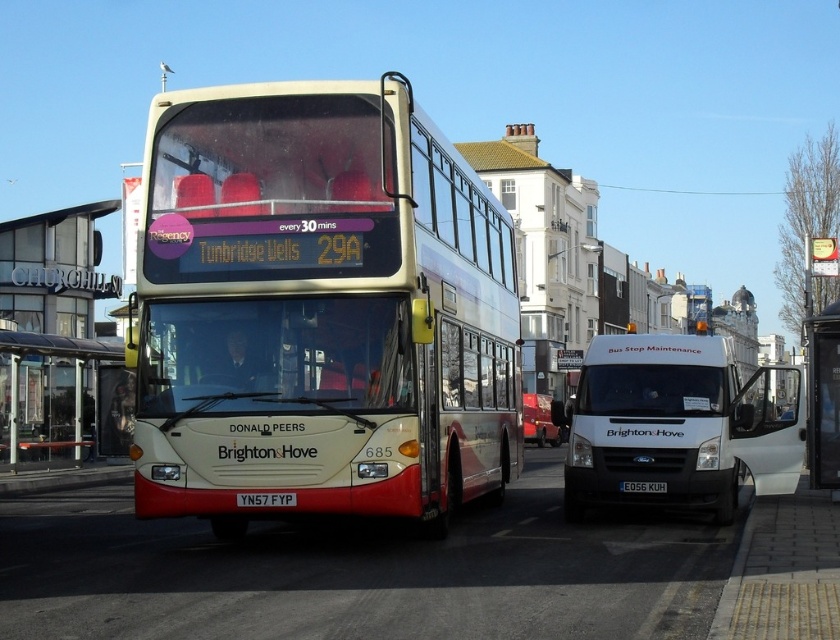
Question: Considering the relative positions of matte cream double-decker bus at center and white matte van at center in the image provided, where is matte cream double-decker bus at center located with respect to white matte van at center?

Choices:
 (A) above
 (B) below

Answer: (B)

Question: Among these objects, which one is farthest from the camera?

Choices:
 (A) yellow metallic license plate at center
 (B) transparent glass bus stop at left
 (C) black plastic license plate at center

Answer: (B)

Question: Does white matte van at center have a lesser width compared to transparent glass bus stop at left?

Choices:
 (A) yes
 (B) no

Answer: (B)

Question: Which point is farther from the camera taking this photo?

Choices:
 (A) (237, 500)
 (B) (13, 424)

Answer: (B)

Question: Where is white matte van at center located in relation to black plastic license plate at center in the image?

Choices:
 (A) above
 (B) below

Answer: (A)

Question: Which of the following is the farthest from the observer?

Choices:
 (A) transparent glass bus stop at left
 (B) yellow metallic license plate at center

Answer: (A)